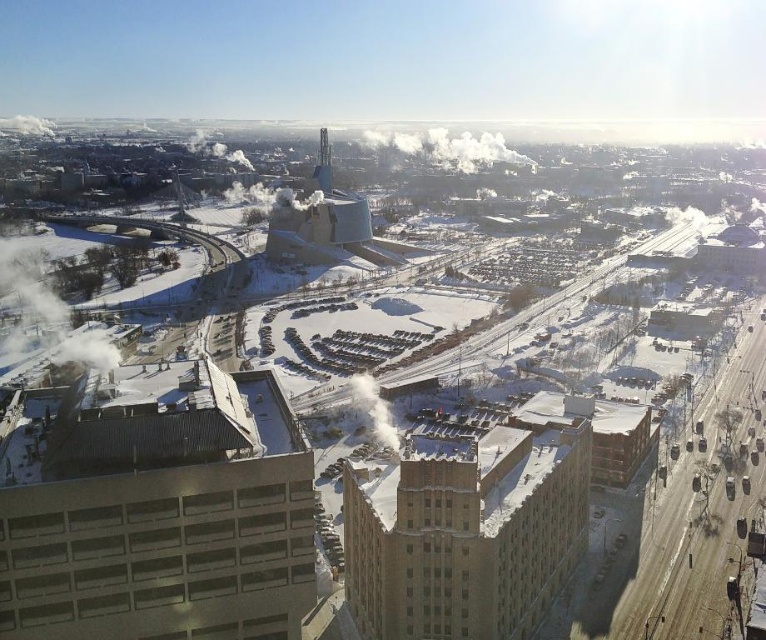
You are a drone operator trying to navigate through the city. You need to locate a specific point marked at coordinates (x=159, y=513). Based on the city layout described, where would this point be located in relation to the gray concrete building at lower left?

The point at coordinates (x=159, y=513) is located on the gray concrete building at lower left.

You are a city planner reviewing this aerial view of the city. You need to determine which of the two buildings, the gray concrete building at lower left or the brown brick building at lower right, has a narrower width. Which one is it?

The gray concrete building at lower left is thinner than the brown brick building at lower right, so the gray concrete building at lower left has a narrower width.

You are a drone operator trying to navigate between the gray concrete building at lower left and the brown brick building at lower right. Which building is located to the left when viewed from above?

The gray concrete building at lower left is positioned on the left side of the brown brick building at lower right, so when viewed from above, the gray concrete building at lower left is to the left of the brown brick building at lower right.